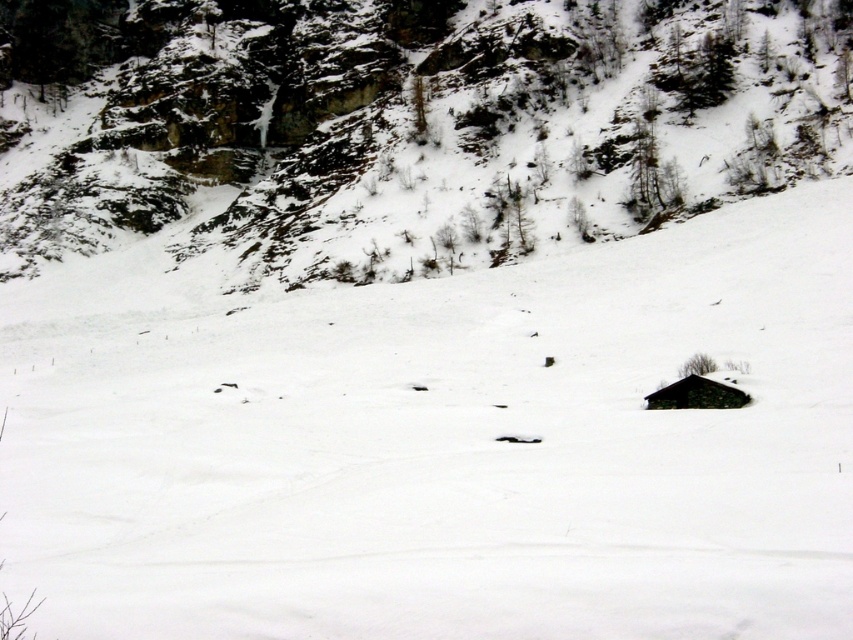
You are a hiker trying to navigate through the snowy landscape. You see the rocky cliff at upper left and the stone roof hut at lower right. Which object is positioned higher in the image?

The rocky cliff at upper left is located above the stone roof hut at lower right, so it is positioned higher in the image.

Based on the photo, you are standing at the point marked as point [67,320] and want to walk to the point marked as point [488,164]. Given that the distance between these two points is 200 meters, and your walking speed is 5 meters per minute, how many minutes will it take you to reach the destination?

The distance between point [67,320] and point [488,164] is 200 meters. At a walking speed of 5 meters per minute, it will take 40 minutes to reach the destination.